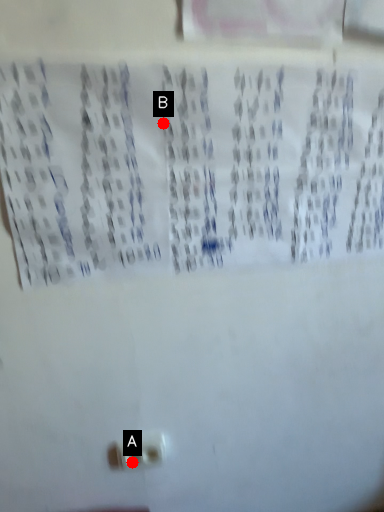
Question: Two points are circled on the image, labeled by A and B beside each circle. Which of the following is the farthest from the observer?

Choices:
 (A) A is further
 (B) B is further

Answer: (A)